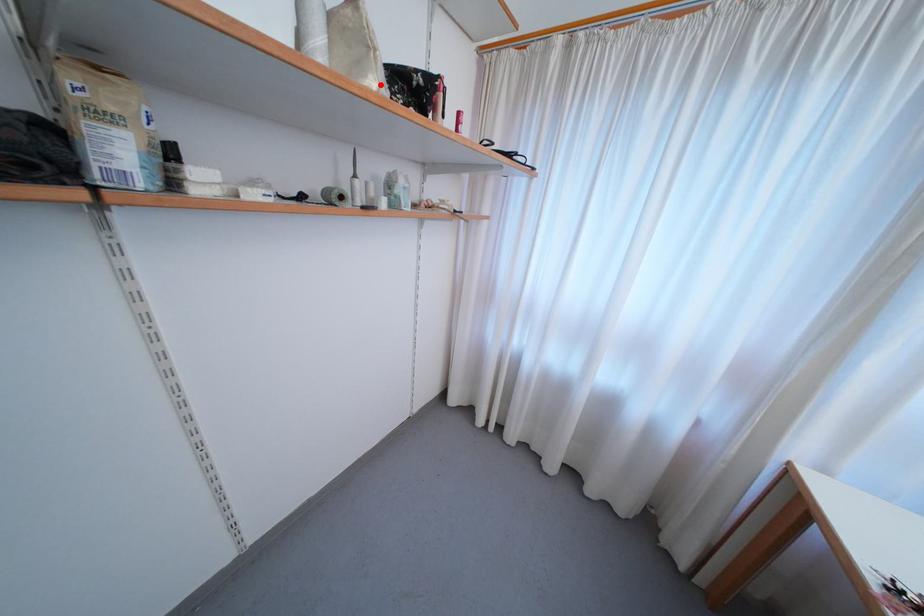
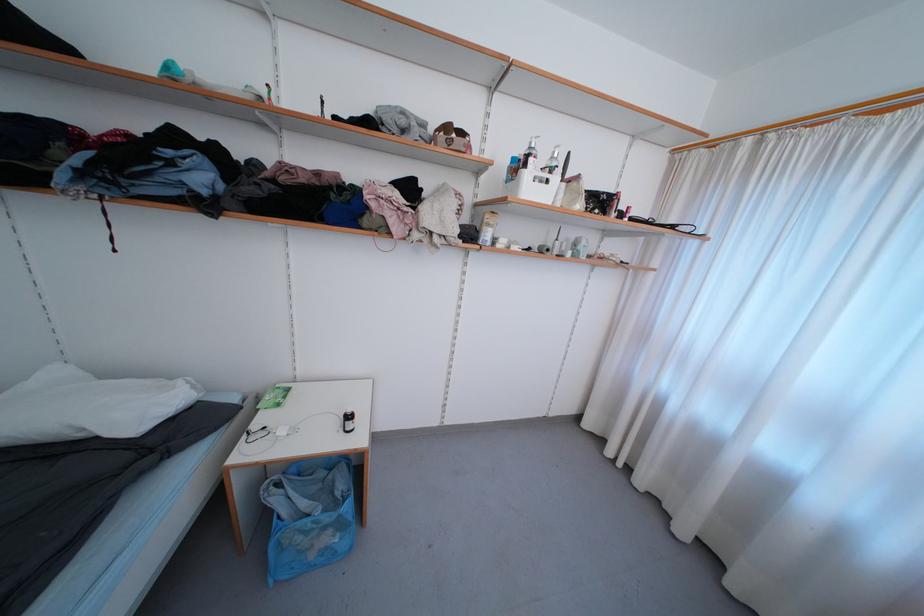
In the second image, find the point that corresponds to the highlighted location in the first image.

(584, 208)